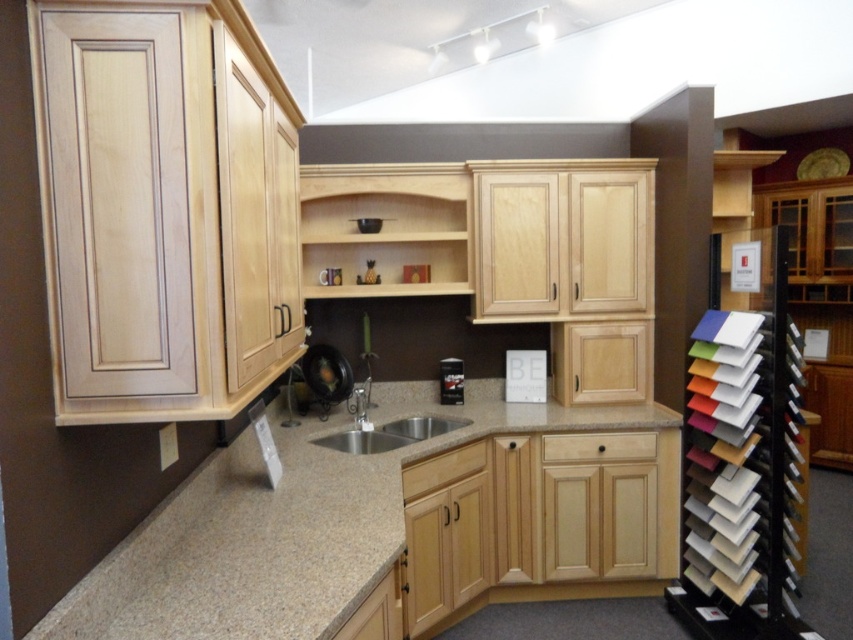
Question: Based on their relative distances, which object is farther from the satin nickel faucet at center?

Choices:
 (A) wooden shelves at center
 (B) stainless steel sink at center
 (C) granite countertop at center

Answer: (C)

Question: Among these points, which one is farthest from the camera?

Choices:
 (A) (259, 525)
 (B) (343, 436)
 (C) (450, 378)
 (D) (315, 184)

Answer: (C)

Question: Which of the following is the farthest from the observer?

Choices:
 (A) (525, 445)
 (B) (323, 440)
 (C) (318, 230)
 (D) (453, 380)

Answer: (D)

Question: Does granite countertop at center have a lesser width compared to wooden shelves at center?

Choices:
 (A) yes
 (B) no

Answer: (B)

Question: Can you confirm if granite countertop at center is positioned below stainless steel sink at center?

Choices:
 (A) no
 (B) yes

Answer: (B)

Question: Where is stainless steel sink at center located in relation to satin nickel faucet at center in the image?

Choices:
 (A) below
 (B) above

Answer: (A)